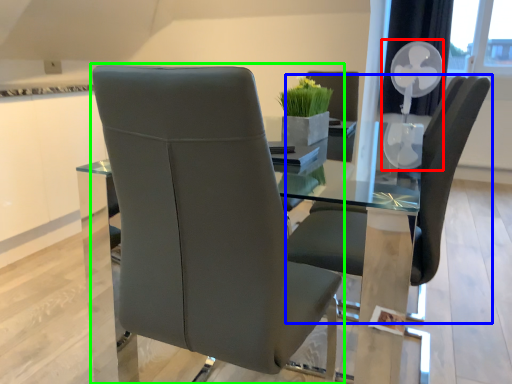
Question: Which object is the farthest from fan (highlighted by a red box)? Choose among these: chair (highlighted by a blue box) or chair (highlighted by a green box).

Choices:
 (A) chair
 (B) chair

Answer: (B)